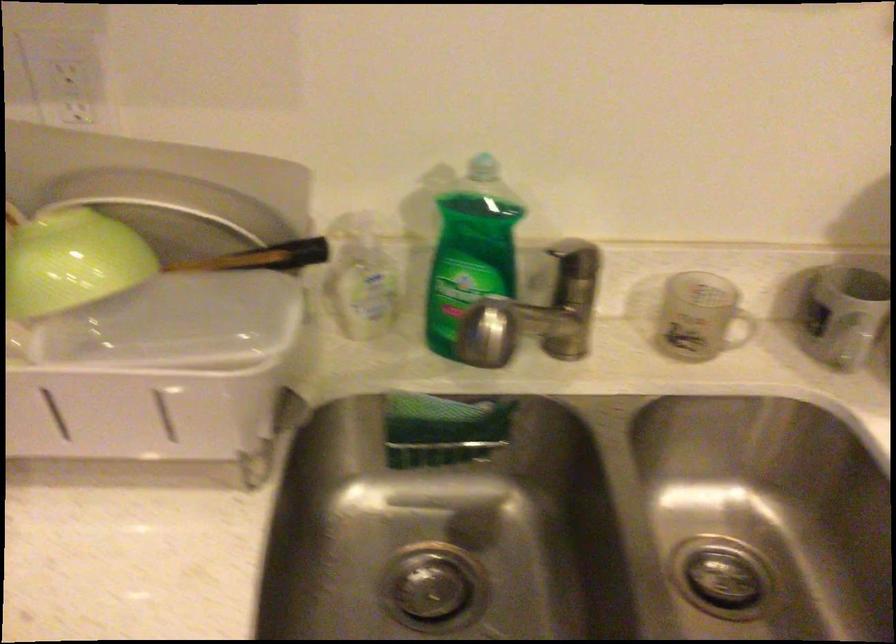
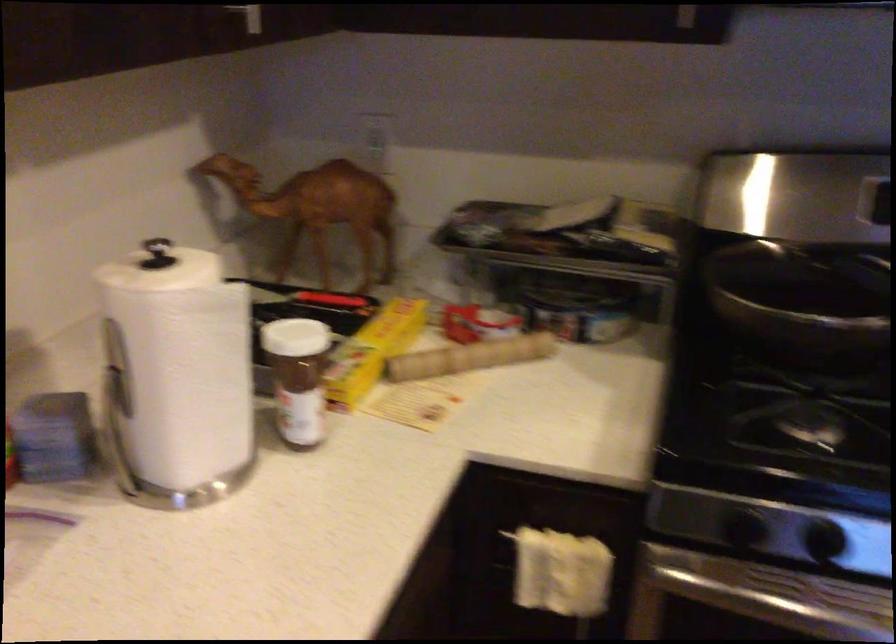
Question: The camera is either moving clockwise (left) or counter-clockwise (right) around the object. The first image is from the beginning of the video and the second image is from the end. Is the camera moving left or right when shooting the video?

Choices:
 (A) Left
 (B) Right

Answer: (A)